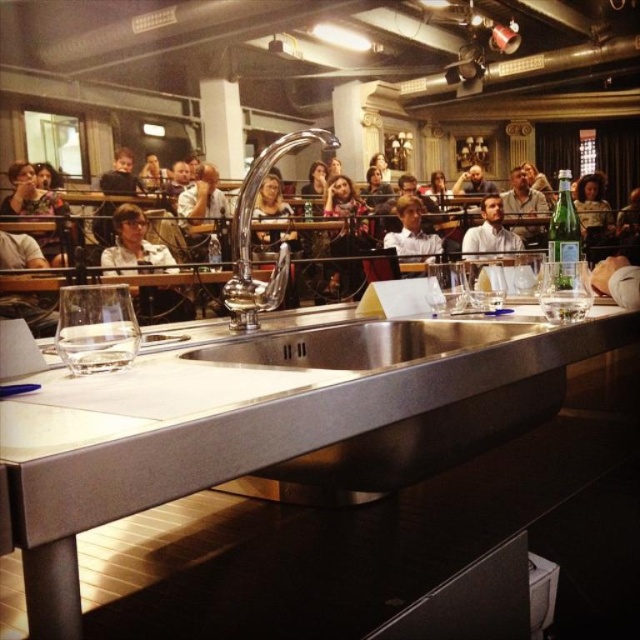
Question: Which of the following is the closest to the observer?

Choices:
 (A) (588, 291)
 (B) (218, 342)

Answer: (B)

Question: Which of the following is the farthest from the observer?

Choices:
 (A) (310, 129)
 (B) (566, 256)
 (C) (486, 321)
 (D) (545, 300)

Answer: (B)

Question: Does stainless steel sink at center have a greater width compared to polished chrome faucet at center?

Choices:
 (A) yes
 (B) no

Answer: (A)

Question: Among these points, which one is farthest from the camera?

Choices:
 (A) (360, 328)
 (B) (230, 291)
 (C) (552, 269)
 (D) (547, 285)

Answer: (A)

Question: In this image, where is green glass bottle at center located relative to transparent glass at center?

Choices:
 (A) above
 (B) below

Answer: (A)

Question: Does polished chrome faucet at center appear on the left side of transparent glass at center?

Choices:
 (A) yes
 (B) no

Answer: (A)